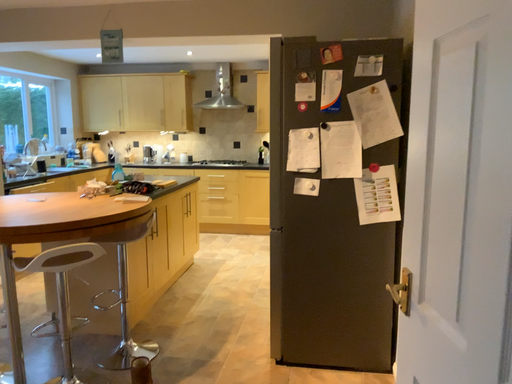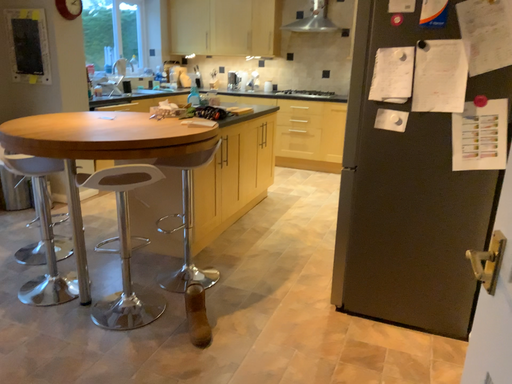
Question: Which way did the camera rotate in the video?

Choices:
 (A) rotated left
 (B) rotated right

Answer: (A)